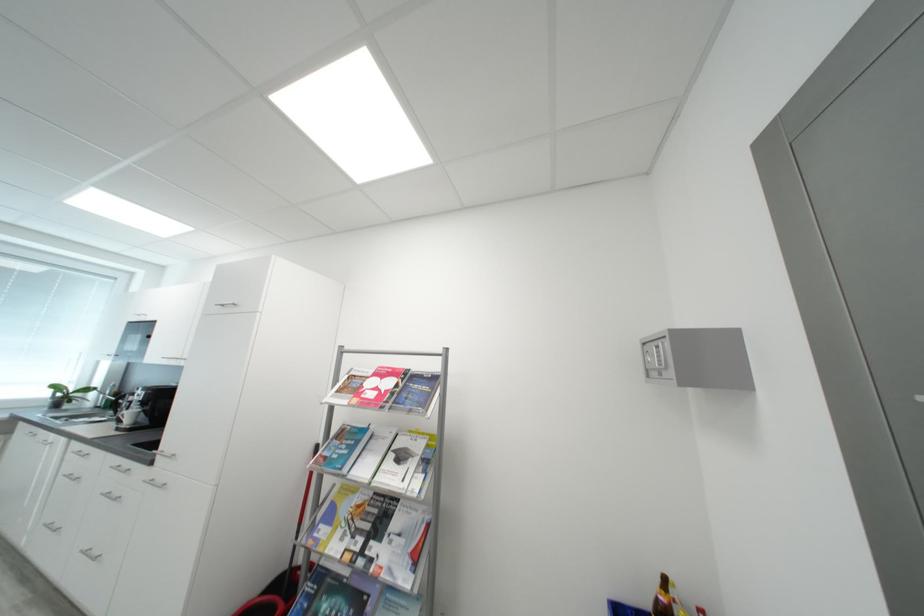
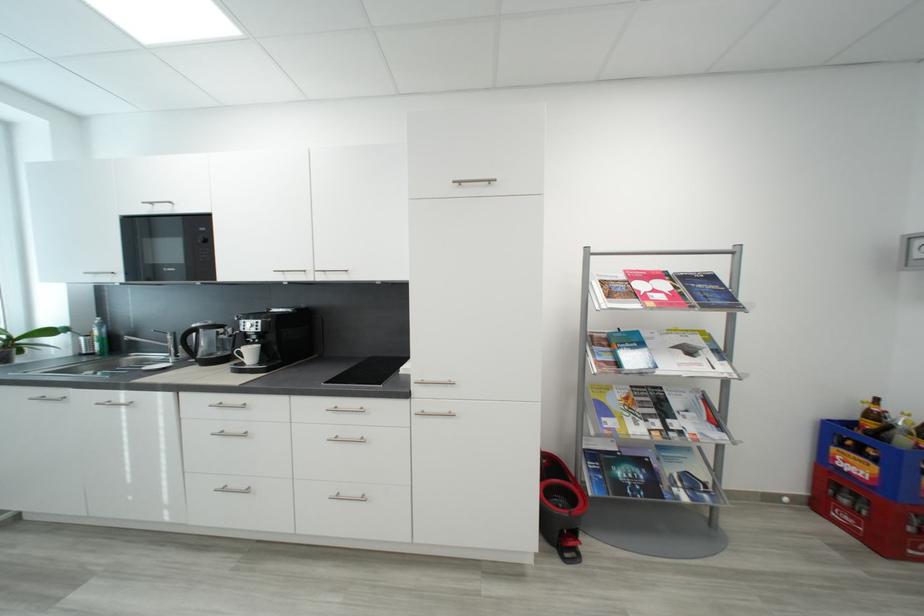
Find the pixel in the second image that matches pixel 138 416 in the first image.

(257, 354)